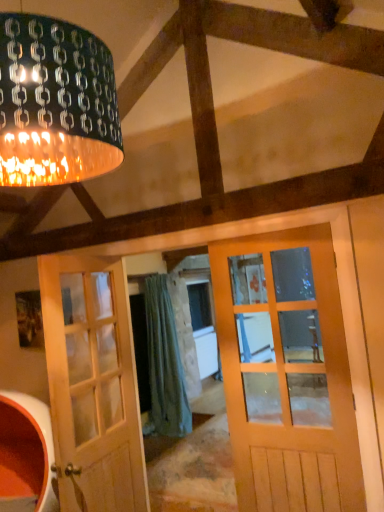
Question: Considering the positions of point (51, 387) and point (185, 433), is point (51, 387) closer or farther from the camera than point (185, 433)?

Choices:
 (A) closer
 (B) farther

Answer: (A)

Question: Considering the positions of white wood door at left and green fabric curtain at center in the image, is white wood door at left wider or thinner than green fabric curtain at center?

Choices:
 (A) wide
 (B) thin

Answer: (B)

Question: Which object is the closest to the matte black lampshade at upper left?

Choices:
 (A) white wood door at left
 (B) green fabric curtain at center

Answer: (A)

Question: Which of these objects is positioned farthest from the matte black lampshade at upper left?

Choices:
 (A) green fabric curtain at center
 (B) white wood door at left

Answer: (A)